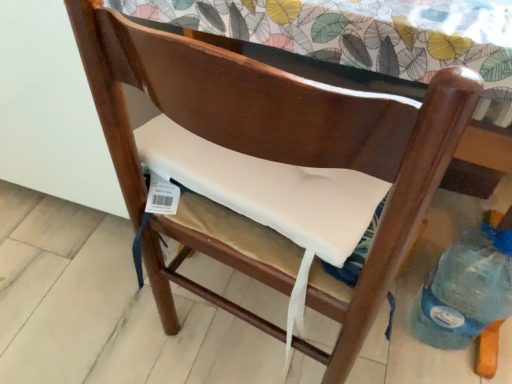
The image size is (512, 384). What are the coordinates of `free space that is to the left of blue plastic bottle at lower right` in the screenshot? It's located at (389, 339).